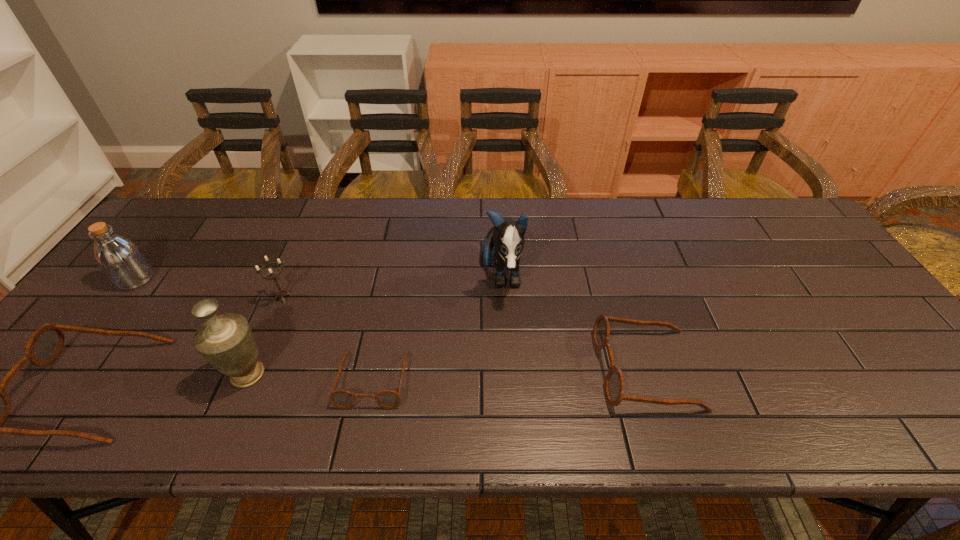
This screenshot has height=540, width=960. Find the location of `the shortest spectacles`. the shortest spectacles is located at coordinates (343, 399).

Locate an element on the screen. This screenshot has height=540, width=960. the shortest object is located at coordinates (343, 399).

This screenshot has width=960, height=540. In order to click on the second tallest spectacles in this screenshot , I will do `click(614, 386)`.

The height and width of the screenshot is (540, 960). I want to click on the rightmost object, so click(614, 386).

Locate an element on the screen. This screenshot has height=540, width=960. puppy is located at coordinates (507, 236).

Find the location of `the second object from right to left`. the second object from right to left is located at coordinates click(507, 236).

Identify the location of candle holder. (281, 293).

You are a GUI agent. You are given a task and a screenshot of the screen. Output one action in this format:
    pyautogui.click(x=<x>, y=<y>)
    Task: Click on the bottle
    This screenshot has width=960, height=540.
    Given the screenshot: What is the action you would take?
    pyautogui.click(x=122, y=261)

Where is `the second tallest object`? the second tallest object is located at coordinates (226, 341).

At what (x,y) coordinates should I click in order to perform the action: click on blank space located 0.170m on the front-facing side of the rightmost spectacles. Please return your answer as a coordinate pair (x, y). Looking at the image, I should click on (525, 369).